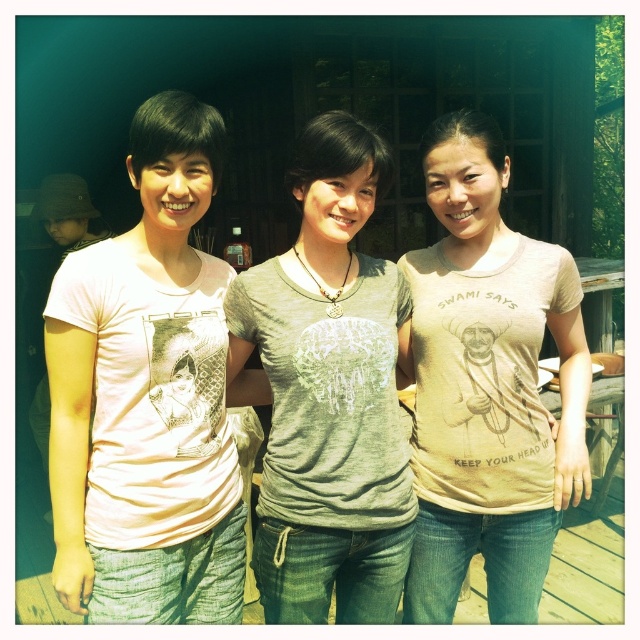
Can you confirm if beige cotton t-shirt at center is smaller than gray matte t-shirt at center?

No.

Is beige cotton t-shirt at center below gray matte t-shirt at center?

Yes, beige cotton t-shirt at center is below gray matte t-shirt at center.

Identify the location of beige cotton t-shirt at center. This screenshot has width=640, height=640. (488, 387).

Is point (148, 545) positioned in front of point (364, 518)?

Yes, point (148, 545) is closer to viewer.

Who is higher up, matte pink t-shirt at left or gray matte t-shirt at center?

matte pink t-shirt at left is above.

This screenshot has height=640, width=640. I want to click on matte pink t-shirt at left, so click(147, 396).

Does matte pink t-shirt at left appear over beige cotton t-shirt at center?

Correct, matte pink t-shirt at left is located above beige cotton t-shirt at center.

Does matte pink t-shirt at left have a lesser height compared to beige cotton t-shirt at center?

Yes.

What do you see at coordinates (147, 396) in the screenshot? I see `matte pink t-shirt at left` at bounding box center [147, 396].

Identify the location of matte pink t-shirt at left. This screenshot has width=640, height=640. (147, 396).